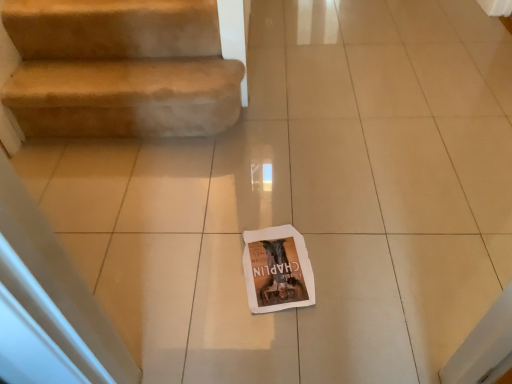
The width and height of the screenshot is (512, 384). In order to click on vacant space behind white paper at center in this screenshot , I will do `click(274, 218)`.